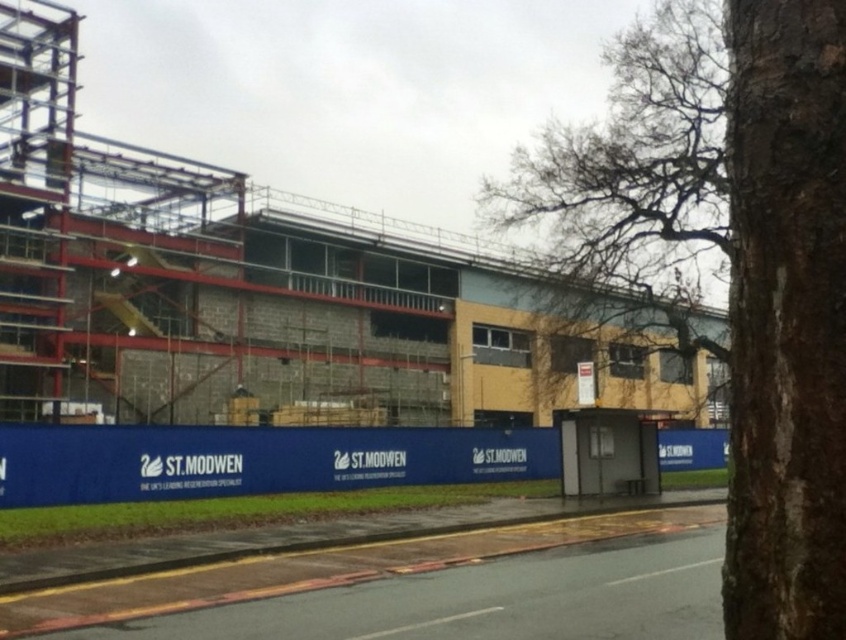
Who is higher up, brown rough bark tree at right or bare branches at upper right?

bare branches at upper right

Is point (816, 173) positioned in front of point (621, 227)?

That is True.

Does point (751, 620) lie in front of point (608, 317)?

That is True.

Find the location of a particular element. This screenshot has width=846, height=640. brown rough bark tree at right is located at coordinates (784, 320).

From the picture: Which is below, brown rough bark tree at center right or bare branches at upper right?

brown rough bark tree at center right is below.

Who is more forward, (805, 609) or (595, 189)?

Point (805, 609) is more forward.

This screenshot has width=846, height=640. I want to click on brown rough bark tree at center right, so coord(731,260).

This screenshot has width=846, height=640. What do you see at coordinates (731, 260) in the screenshot?
I see `brown rough bark tree at center right` at bounding box center [731, 260].

Is brown rough bark tree at center right further to the viewer compared to brown rough bark tree at right?

Yes, brown rough bark tree at center right is further from the viewer.

Between point (592, 253) and point (757, 260), which one is positioned behind?

Point (592, 253)

Where is `brown rough bark tree at center right`? brown rough bark tree at center right is located at coordinates (731, 260).